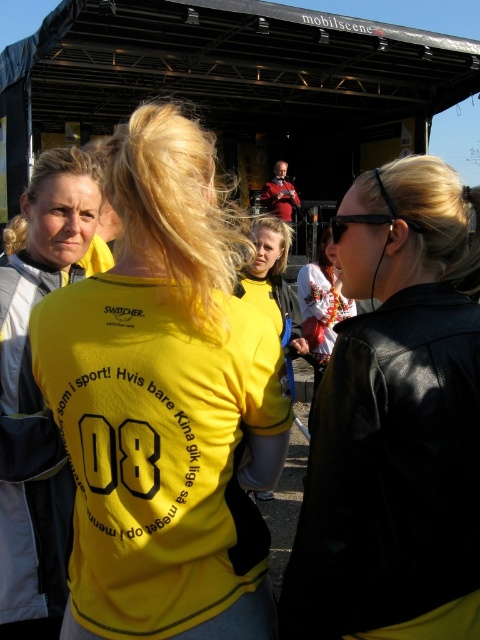
Who is shorter, black leather jacket at upper right or yellow fabric shirt at center?

Standing shorter between the two is black leather jacket at upper right.

Is point (305, 592) positioned after point (277, 260)?

No, (305, 592) is in front of (277, 260).

The width and height of the screenshot is (480, 640). Find the location of `black leather jacket at upper right`. black leather jacket at upper right is located at coordinates (396, 426).

Can you confirm if yellow matte shirt at center is bigger than yellow matte shirt at left?

Correct, yellow matte shirt at center is larger in size than yellow matte shirt at left.

Does point (66, 428) come behind point (24, 512)?

No, (66, 428) is closer to viewer.

This screenshot has height=640, width=480. What do you see at coordinates (165, 404) in the screenshot?
I see `yellow matte shirt at center` at bounding box center [165, 404].

Identify the location of yellow matte shirt at center. (165, 404).

Is yellow matte shirt at center to the left of yellow fabric shirt at center from the viewer's perspective?

Yes, yellow matte shirt at center is to the left of yellow fabric shirt at center.

Who is more distant from viewer, (113, 458) or (276, 236)?

Point (276, 236)

I want to click on yellow matte shirt at center, so click(x=165, y=404).